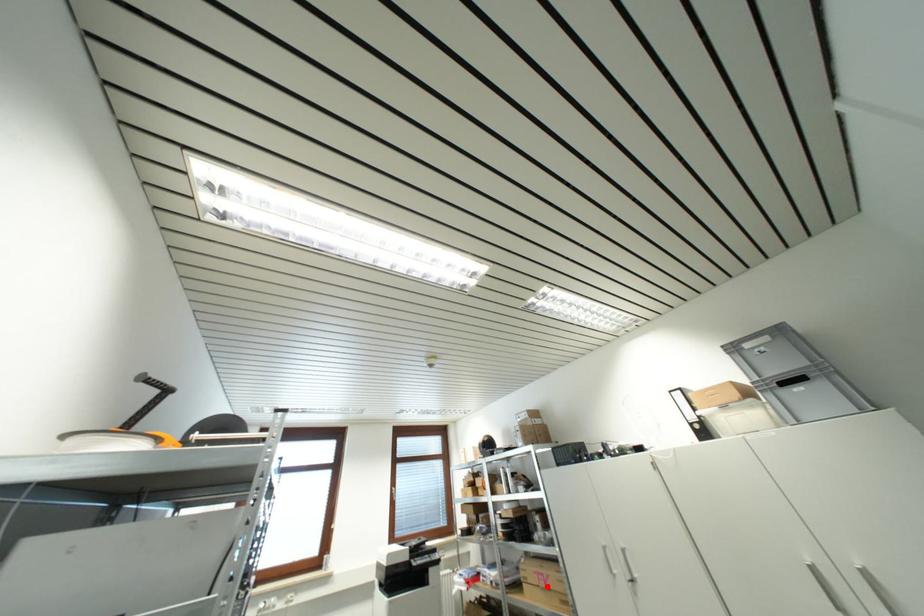
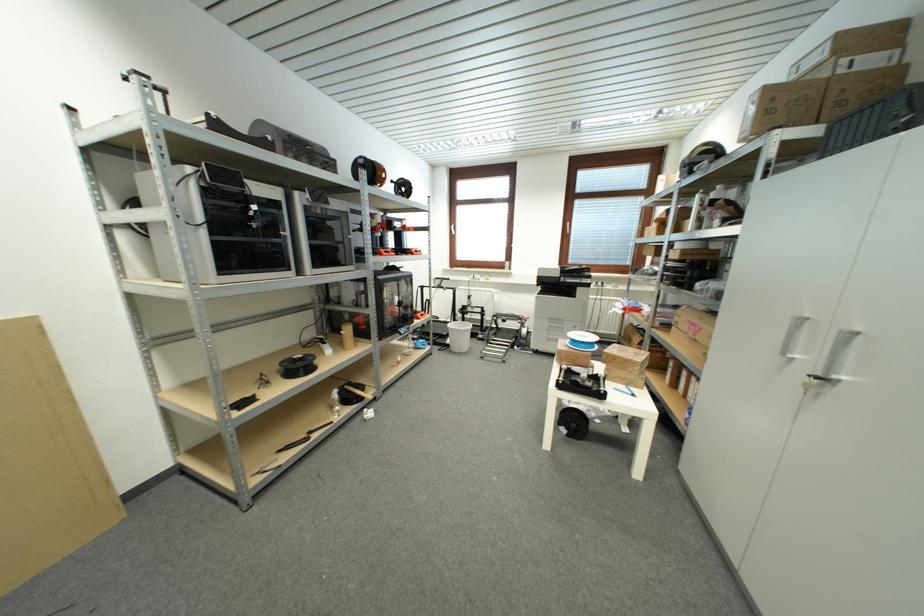
Question: I am providing you with two images of the same scene from different viewpoints. Given a red point in image1, look at the same physical point in image2. Is it:

Choices:
 (A) Closer to the viewpoint
 (B) Farther from the viewpoint

Answer: (A)